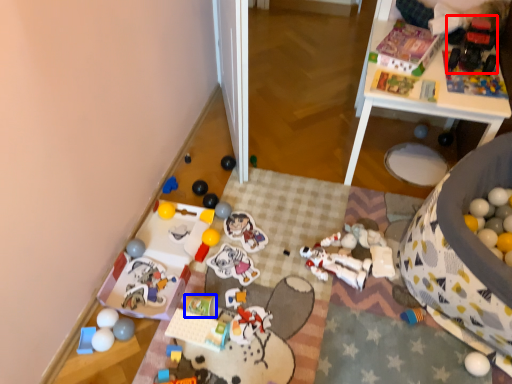
Question: Which point is further to the camera, toy (highlighted by a red box) or toy (highlighted by a blue box)?

Choices:
 (A) toy
 (B) toy

Answer: (A)